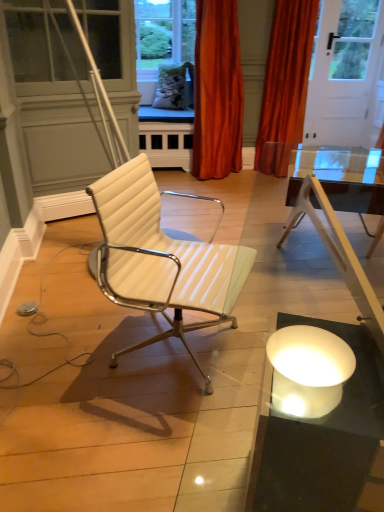
Where is `vacant area in front of white leather chair at center`? The height and width of the screenshot is (512, 384). vacant area in front of white leather chair at center is located at coordinates (147, 433).